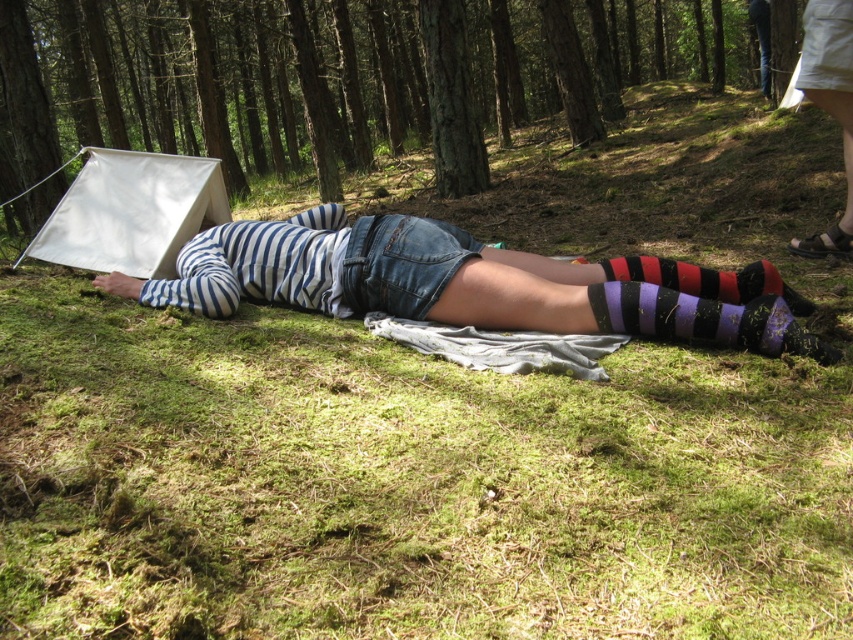
Question: Is green mossy ground at center smaller than purple striped sock at lower center?

Choices:
 (A) no
 (B) yes

Answer: (A)

Question: Can you confirm if green mossy ground at center is positioned above purple striped sock at lower center?

Choices:
 (A) yes
 (B) no

Answer: (A)

Question: Estimate the real-world distances between objects in this image. Which object is closer to the purple striped sock at lower center?

Choices:
 (A) striped fabric at center
 (B) green mossy ground at center

Answer: (A)

Question: Is green mossy ground at center below striped fabric at center?

Choices:
 (A) yes
 (B) no

Answer: (B)

Question: Which of the following is the closest to the observer?

Choices:
 (A) [x=708, y=308]
 (B) [x=440, y=240]

Answer: (A)

Question: Among these points, which one is farthest from the camera?

Choices:
 (A) (619, 307)
 (B) (607, 298)
 (C) (399, 38)

Answer: (C)